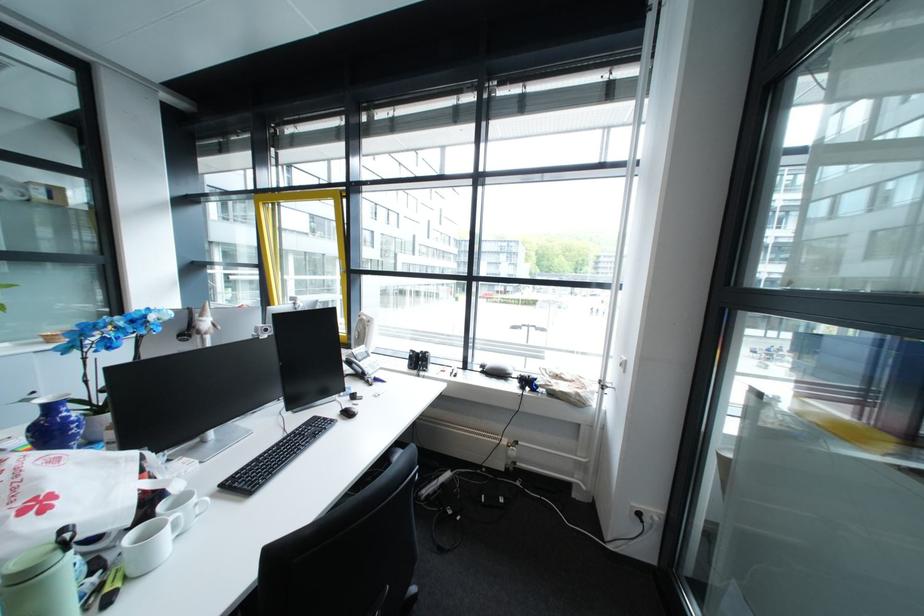
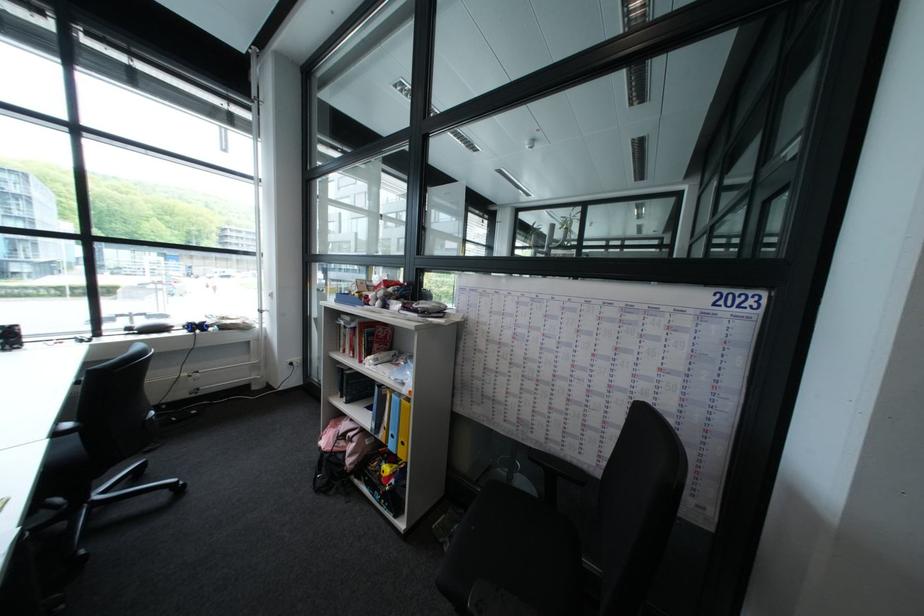
In the second image, find the point that corresponds to point (536, 375) in the first image.

(203, 322)